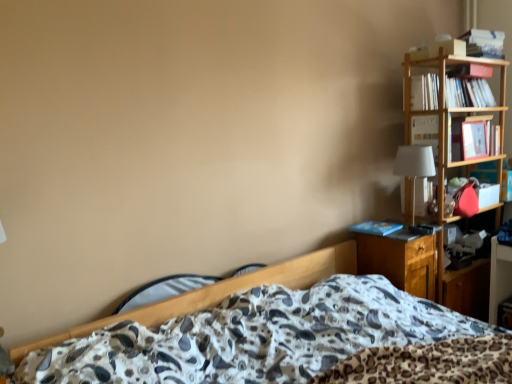
This screenshot has width=512, height=384. Describe the element at coordinates (414, 166) in the screenshot. I see `white fabric lampshade at right` at that location.

The width and height of the screenshot is (512, 384). What do you see at coordinates (376, 228) in the screenshot?
I see `blue matte book at right, the 4th book when ordered from top to bottom` at bounding box center [376, 228].

Where is `wooden nightstand at right`? wooden nightstand at right is located at coordinates (401, 262).

Image resolution: width=512 pixels, height=384 pixels. What do you see at coordinates (483, 43) in the screenshot?
I see `hardcover book at upper right, which appears as the fourth book when ordered from the bottom` at bounding box center [483, 43].

At what (x,y) coordinates should I click in order to perform the action: click on hardcover book at upper right, which appears as the fourth book when ordered from the bottom. Please return your answer as a coordinate pair (x, y). Looking at the image, I should click on (483, 43).

Describe the element at coordinates (425, 131) in the screenshot. I see `hardcover book at upper right, the 3th book when ordered from top to bottom` at that location.

The height and width of the screenshot is (384, 512). Find the location of `white paper book at upper right, the 3th book ordered from the bottom`. white paper book at upper right, the 3th book ordered from the bottom is located at coordinates (468, 93).

Find the location of a particular element. white fabric lampshade at right is located at coordinates (414, 166).

In terms of size, does blue matte book at right, the 4th book when ordered from top to bottom, appear bigger or smaller than wooden nightstand at right?

In the image, blue matte book at right, the 4th book when ordered from top to bottom, appears to be smaller than wooden nightstand at right.

Is point (380, 224) more distant than point (402, 246)?

Yes.

Where is `nightstand below the blue matte book at right, the 4th book when ordered from top to bottom (from the image's perspective)`? This screenshot has width=512, height=384. nightstand below the blue matte book at right, the 4th book when ordered from top to bottom (from the image's perspective) is located at coordinates (401, 262).

Which is correct: blue matte book at right, the 4th book when ordered from top to bottom, is inside wooden nightstand at right, or outside of it?

blue matte book at right, the 4th book when ordered from top to bottom, is spatially positioned inside wooden nightstand at right.

Considering the relative sizes of white paper book at upper right, the 3th book ordered from the bottom, and blue matte book at right, the 4th book when ordered from top to bottom, in the image provided, is white paper book at upper right, the 3th book ordered from the bottom, wider than blue matte book at right, the 4th book when ordered from top to bottom,?

In fact, white paper book at upper right, the 3th book ordered from the bottom, might be narrower than blue matte book at right, the 4th book when ordered from top to bottom.

From the image's perspective, which object appears higher, white paper book at upper right, the 3th book ordered from the bottom, or blue matte book at right, marked as the first book in a bottom-to-top arrangement?

white paper book at upper right, the 3th book ordered from the bottom, from the image's perspective.

From a real-world perspective, is white paper book at upper right, the 3th book ordered from the bottom, over blue matte book at right, marked as the first book in a bottom-to-top arrangement?

Yes, from a real-world perspective, white paper book at upper right, the 3th book ordered from the bottom, is on top of blue matte book at right, marked as the first book in a bottom-to-top arrangement.

Does white paper book at upper right, the 3th book ordered from the bottom, come in front of blue matte book at right, the 4th book when ordered from top to bottom?

No.

Between point (484, 30) and point (428, 286), which one is positioned in front?

The point (428, 286) is closer.

Locate an element on the screen. This screenshot has width=512, height=384. the 3rd book to the right when counting from the wooden nightstand at right is located at coordinates (483, 43).

Considering the sizes of objects hardcover book at upper right, the 1th book from the top, and wooden nightstand at right in the image provided, who is wider, hardcover book at upper right, the 1th book from the top, or wooden nightstand at right?

wooden nightstand at right is wider.

Does hardcover book at upper right, the 1th book from the top, appear on the left side of wooden nightstand at right?

No, hardcover book at upper right, the 1th book from the top, is not to the left of wooden nightstand at right.

Which of these two, white fabric lampshade at right or wooden nightstand at right, stands taller?

With more height is wooden nightstand at right.

Is white fabric lampshade at right wider than wooden nightstand at right?

No, white fabric lampshade at right is not wider than wooden nightstand at right.

From a real-world perspective, which is physically above, white fabric lampshade at right or wooden nightstand at right?

white fabric lampshade at right.

How different are the orientations of white fabric lampshade at right and wooden nightstand at right in degrees?

The angular difference between white fabric lampshade at right and wooden nightstand at right is 0.000964 degrees.

From a real-world perspective, which object rests below the other?

hardcover book at upper right, the 3th book when ordered from top to bottom.

Is point (429, 87) positioned before point (424, 123)?

Yes, it is in front of point (424, 123).

Can you confirm if white paper book at upper right, marked as the 2th book in a top-to-bottom arrangement, is smaller than hardcover book at upper right, the 2th book positioned from the bottom?

No.

From a real-world perspective, is wooden nightstand at right physically above hardcover book at upper right, which appears as the fourth book when ordered from the bottom?

No, from a real-world perspective, wooden nightstand at right is not above hardcover book at upper right, which appears as the fourth book when ordered from the bottom.

Which object is further away from the camera, wooden nightstand at right or hardcover book at upper right, which appears as the fourth book when ordered from the bottom?

hardcover book at upper right, which appears as the fourth book when ordered from the bottom, is more distant.

Do you think wooden nightstand at right is within hardcover book at upper right, the 1th book from the top, or outside of it?

wooden nightstand at right is located beyond the bounds of hardcover book at upper right, the 1th book from the top.

Considering the relative sizes of wooden nightstand at right and hardcover book at upper right, which appears as the fourth book when ordered from the bottom, in the image provided, is wooden nightstand at right wider than hardcover book at upper right, which appears as the fourth book when ordered from the bottom,?

Yes.

Between hardcover book at upper right, the 1th book from the top, and blue matte book at right, the 4th book when ordered from top to bottom, which one has smaller size?

With smaller size is blue matte book at right, the 4th book when ordered from top to bottom.

Considering the sizes of objects hardcover book at upper right, the 1th book from the top, and blue matte book at right, the 4th book when ordered from top to bottom, in the image provided, who is shorter, hardcover book at upper right, the 1th book from the top, or blue matte book at right, the 4th book when ordered from top to bottom,?

Standing shorter between the two is blue matte book at right, the 4th book when ordered from top to bottom.

Is hardcover book at upper right, which appears as the fourth book when ordered from the bottom, not inside blue matte book at right, the 4th book when ordered from top to bottom?

Yes, hardcover book at upper right, which appears as the fourth book when ordered from the bottom, is not within blue matte book at right, the 4th book when ordered from top to bottom.

There is a wooden nightstand at right. Identify the location of the 1st book above it (from the image's perspective). (376, 228).

Identify the location of the 2nd book behind the blue matte book at right, marked as the first book in a bottom-to-top arrangement, starting your count from the anchor. (468, 93).

Based on their spatial positions, is white fabric lampshade at right or white paper book at upper right, the 3th book ordered from the bottom, further from hardcover book at upper right, which appears as the fourth book when ordered from the bottom?

The object further to hardcover book at upper right, which appears as the fourth book when ordered from the bottom, is white fabric lampshade at right.

Which object lies nearer to the anchor point hardcover book at upper right, the 1th book from the top, hardcover book at upper right, the 2th book positioned from the bottom, or white fabric lampshade at right?

hardcover book at upper right, the 2th book positioned from the bottom.

From the image, which object appears to be farther from blue matte book at right, the 4th book when ordered from top to bottom, hardcover book at upper right, the 1th book from the top, or white paper book at upper right, the 3th book ordered from the bottom?

The object further to blue matte book at right, the 4th book when ordered from top to bottom, is hardcover book at upper right, the 1th book from the top.

Which object lies further to the anchor point wooden nightstand at right, blue matte book at right, marked as the first book in a bottom-to-top arrangement, or white fabric lampshade at right?

white fabric lampshade at right is positioned further to the anchor wooden nightstand at right.

Considering their positions, is white paper book at upper right, the 3th book ordered from the bottom, positioned further to hardcover book at upper right, the 3th book when ordered from top to bottom, than wooden nightstand at right?

Based on the image, wooden nightstand at right appears to be further to hardcover book at upper right, the 3th book when ordered from top to bottom.

From the image, which object appears to be farther from wooden nightstand at right, white fabric lampshade at right or blue matte book at right, the 4th book when ordered from top to bottom?

The object further to wooden nightstand at right is white fabric lampshade at right.

From the image, which object appears to be nearer to hardcover book at upper right, the 3th book when ordered from top to bottom, wooden nightstand at right or white fabric lampshade at right?

white fabric lampshade at right lies closer to hardcover book at upper right, the 3th book when ordered from top to bottom, than the other object.

Which object lies further to the anchor point wooden nightstand at right, white paper book at upper right, marked as the 2th book in a top-to-bottom arrangement, or hardcover book at upper right, which appears as the fourth book when ordered from the bottom?

hardcover book at upper right, which appears as the fourth book when ordered from the bottom.

The height and width of the screenshot is (384, 512). Identify the location of table lamp between white paper book at upper right, marked as the 2th book in a top-to-bottom arrangement, and wooden nightstand at right vertically. (414, 166).

You are a GUI agent. You are given a task and a screenshot of the screen. Output one action in this format:
    pyautogui.click(x=<x>, y=<y>)
    Task: Click on the book between white fabric lampshade at right and wooden nightstand at right from top to bottom
    This screenshot has width=512, height=384.
    Given the screenshot: What is the action you would take?
    pyautogui.click(x=376, y=228)

At what (x,y) coordinates should I click in order to perform the action: click on table lamp between hardcover book at upper right, the 3th book when ordered from top to bottom, and wooden nightstand at right, in the vertical direction. Please return your answer as a coordinate pair (x, y). This screenshot has width=512, height=384. Looking at the image, I should click on (414, 166).

At what (x,y) coordinates should I click in order to perform the action: click on book between hardcover book at upper right, which appears as the fourth book when ordered from the bottom, and hardcover book at upper right, the 2th book positioned from the bottom, from top to bottom. Please return your answer as a coordinate pair (x, y). Image resolution: width=512 pixels, height=384 pixels. Looking at the image, I should click on (x=468, y=93).